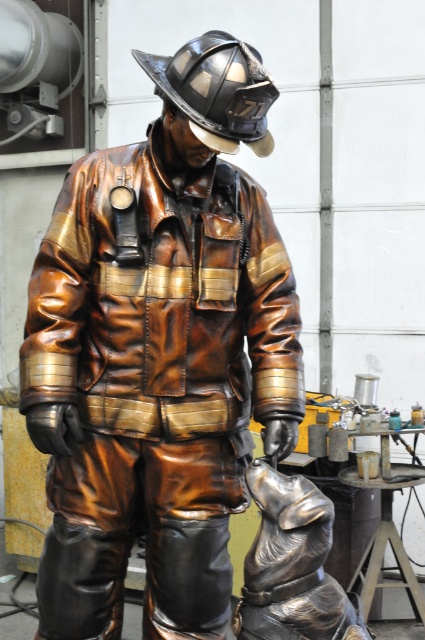
From the picture: You are standing at the point marked by coordinates point (181, 605). You want to throw a ball to a friend who is standing 2.5 meters away from you. Is your friend within reach of your throwing distance?

The distance between you and your friend is 2.5 meters, but the point (181, 605) and viewer are only 2.02 meters apart. Therefore, your friend is beyond your throwing range.